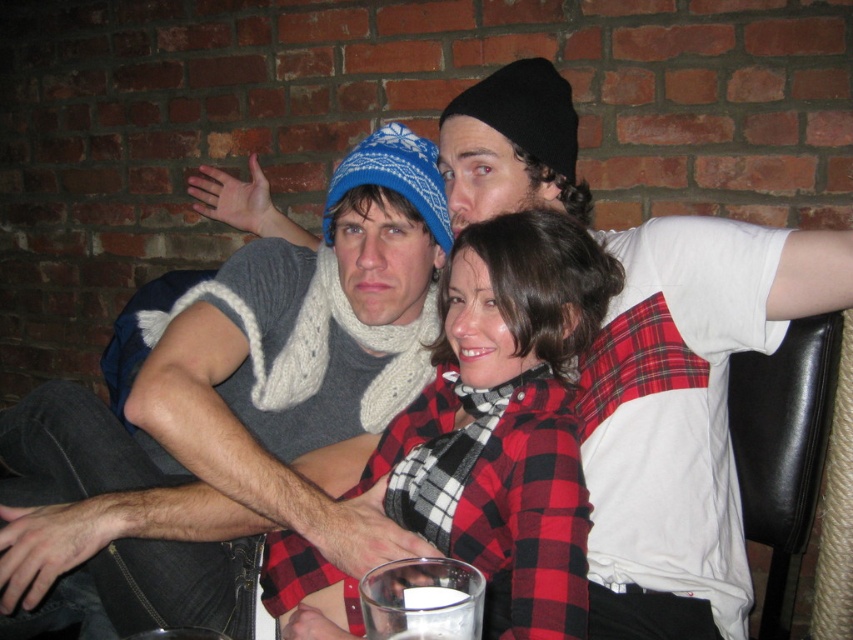
Question: Which point appears farthest from the camera in this image?

Choices:
 (A) (398, 600)
 (B) (439, 387)
 (C) (398, 244)

Answer: (C)

Question: Is knitted wool scarf at upper center above white opaque liquid at lower center?

Choices:
 (A) yes
 (B) no

Answer: (A)

Question: Which object is closer to the camera taking this photo?

Choices:
 (A) red plaid shirt at center
 (B) white opaque liquid at lower center
 (C) knitted wool hat at upper center

Answer: (B)

Question: Is red plaid shirt at center bigger than white opaque liquid at lower center?

Choices:
 (A) no
 (B) yes

Answer: (B)

Question: Which of these objects is positioned farthest from the knitted wool scarf at upper center?

Choices:
 (A) white opaque liquid at lower center
 (B) red plaid shirt at center
 (C) knitted wool hat at upper center

Answer: (A)

Question: Can you confirm if knitted wool scarf at upper center is thinner than red plaid shirt at center?

Choices:
 (A) no
 (B) yes

Answer: (B)